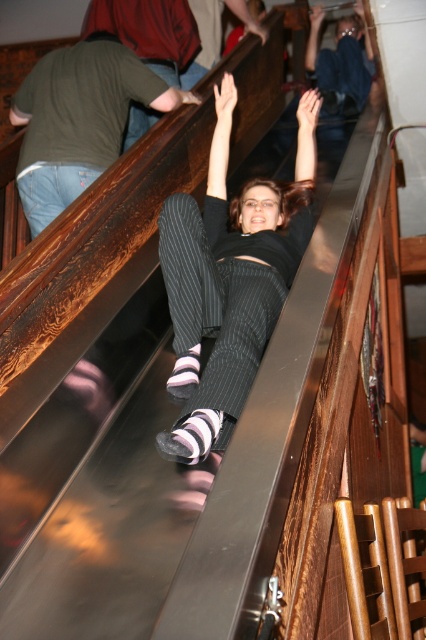
You are standing at the base of the slide and want to reach the top. Which point should you aim for first, point (276, 230) or point (36, 109)?

You should aim for point (276, 230) first because it is in front of point (36, 109), making it closer to your current position at the base of the slide.

You are a photographer trying to capture the best angle of the scene. You notice the black pinstripe pants at center and the jeans at left. Which one should you focus on to ensure they are both in frame without cropping? Explain why based on their positions.

The black pinstripe pants at center is much taller than the jeans at left, so focusing on the black pinstripe pants at center will ensure both are in frame since it is taller and centrally located.

You are a photographer standing at the bottom of the slide. You want to take a photo of both the black pinstripe pants at center and the jeans at left. Which object should you focus on first if you want to capture them both clearly in the frame?

You should focus on the jeans at left first because the black pinstripe pants at center is positioned on the right side of jeans at left, so focusing on the closer object first will ensure both are in focus.